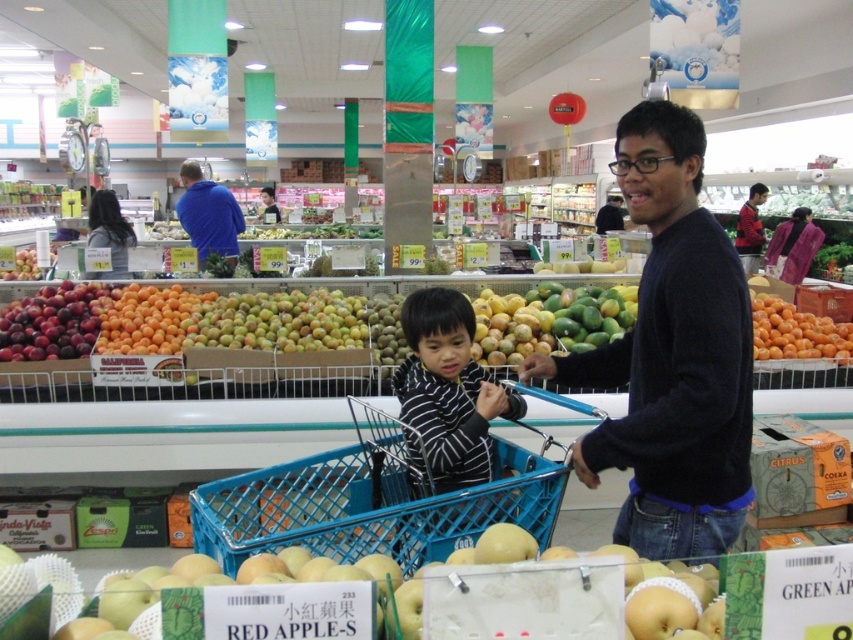
At what (x,y) coordinates should I click in order to perform the action: click on red shirt at upper right. Please return your answer as a coordinate pair (x, y). Image resolution: width=853 pixels, height=640 pixels. Looking at the image, I should click on (750, 227).

Who is taller, red shirt at upper right or black sweater at center?

red shirt at upper right

The width and height of the screenshot is (853, 640). What do you see at coordinates (750, 227) in the screenshot?
I see `red shirt at upper right` at bounding box center [750, 227].

Where is `red shirt at upper right`? Image resolution: width=853 pixels, height=640 pixels. red shirt at upper right is located at coordinates (750, 227).

Does smooth yellow apples at lower center appear under shiny purple plums at left?

Yes, smooth yellow apples at lower center is below shiny purple plums at left.

Which of these two, smooth yellow apples at lower center or shiny purple plums at left, stands shorter?

smooth yellow apples at lower center

Does point (122, 612) come in front of point (68, 346)?

Yes.

Locate an element on the screen. smooth yellow apples at lower center is located at coordinates (183, 586).

Does blue fleece jacket at upper center have a lesser width compared to black sweater at center?

Yes.

Consider the image. Is blue fleece jacket at upper center bigger than black sweater at center?

Incorrect, blue fleece jacket at upper center is not larger than black sweater at center.

Which is in front, point (183, 220) or point (606, 228)?

Point (183, 220)

Where is `blue fleece jacket at upper center`? blue fleece jacket at upper center is located at coordinates (207, 214).